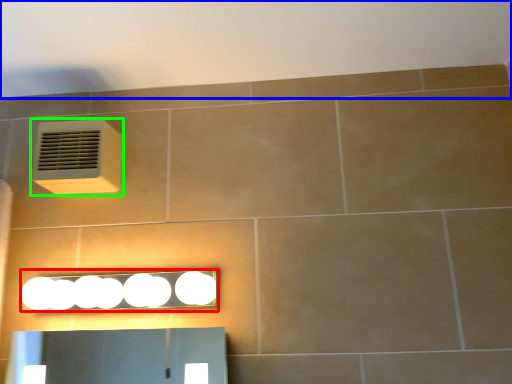
Question: Based on their relative distances, which object is nearer to light fixture (highlighted by a red box)? Choose from backdrop (highlighted by a blue box) and air conditioning (highlighted by a green box).

Choices:
 (A) backdrop
 (B) air conditioning

Answer: (B)